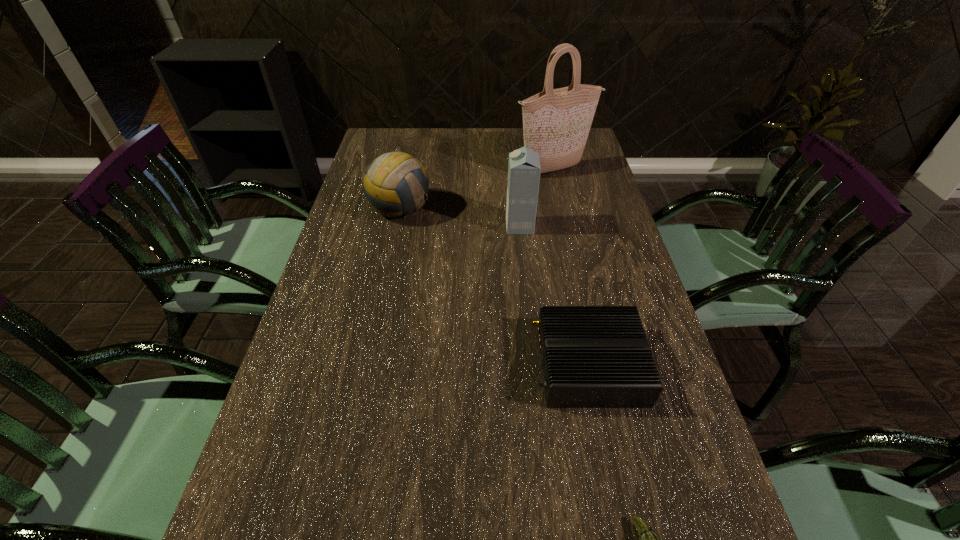
You are a GUI agent. You are given a task and a screenshot of the screen. Output one action in this format:
    pyautogui.click(x=<x>, y=<y>)
    Task: Click on the tallest object
    The height and width of the screenshot is (540, 960).
    Given the screenshot: What is the action you would take?
    pyautogui.click(x=556, y=122)

Locate an element on the screen. The height and width of the screenshot is (540, 960). the farthest object is located at coordinates (556, 122).

Identify the location of carton. The height and width of the screenshot is (540, 960). (524, 169).

Where is `the third shortest object`? This screenshot has width=960, height=540. the third shortest object is located at coordinates (396, 184).

You are a GUI agent. You are given a task and a screenshot of the screen. Output one action in this format:
    pyautogui.click(x=<x>, y=<y>)
    Task: Click on the leftmost object
    
    Given the screenshot: What is the action you would take?
    pyautogui.click(x=396, y=184)

You are a GUI agent. You are given a task and a screenshot of the screen. Output one action in this format:
    pyautogui.click(x=<x>, y=<y>)
    Task: Click on the second nearest object
    This screenshot has height=540, width=960.
    Given the screenshot: What is the action you would take?
    pyautogui.click(x=592, y=356)

Where is `the fourth tallest object`? This screenshot has height=540, width=960. the fourth tallest object is located at coordinates (592, 356).

Where is `vacant space located 0.130m on the back of the shopping bag`? This screenshot has width=960, height=540. vacant space located 0.130m on the back of the shopping bag is located at coordinates [x=547, y=141].

At what (x,y) coordinates should I click in order to perform the action: click on free region located 0.070m on the front label of the carton. Please return your answer as a coordinate pair (x, y). This screenshot has height=540, width=960. Looking at the image, I should click on (483, 226).

At what (x,y) coordinates should I click in order to perform the action: click on free space located 0.210m on the front label of the carton. Please return your answer as a coordinate pair (x, y). This screenshot has width=960, height=540. Looking at the image, I should click on point(435,226).